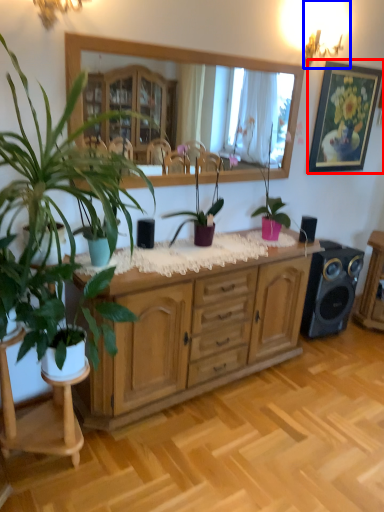
Question: Among these objects, which one is farthest to the camera, picture frame (highlighted by a red box) or lamp (highlighted by a blue box)?

Choices:
 (A) picture frame
 (B) lamp

Answer: (A)